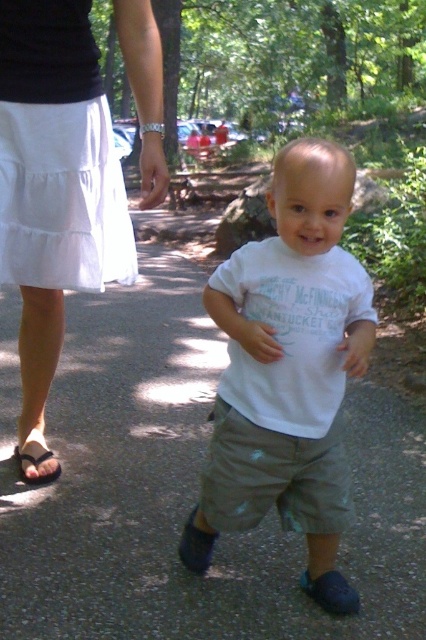
Question: Does white fabric at center have a smaller size compared to white cotton shirt at center?

Choices:
 (A) no
 (B) yes

Answer: (A)

Question: Among these objects, which one is farthest from the camera?

Choices:
 (A) white fabric at center
 (B) white cotton skirt at lower left
 (C) brown leather sandal at lower left
 (D) white cotton shirt at center

Answer: (C)

Question: Considering the relative positions of white cotton shirt at center and white cotton skirt at lower left in the image provided, where is white cotton shirt at center located with respect to white cotton skirt at lower left?

Choices:
 (A) left
 (B) right

Answer: (B)

Question: Among these objects, which one is farthest from the camera?

Choices:
 (A) white cotton shirt at center
 (B) white cotton skirt at lower left

Answer: (B)

Question: Based on their relative distances, which object is farther from the white fabric at center?

Choices:
 (A) brown leather sandal at lower left
 (B) white cotton shirt at center
 (C) white cotton skirt at lower left

Answer: (C)

Question: Does white fabric at center have a greater width compared to white cotton skirt at lower left?

Choices:
 (A) no
 (B) yes

Answer: (B)